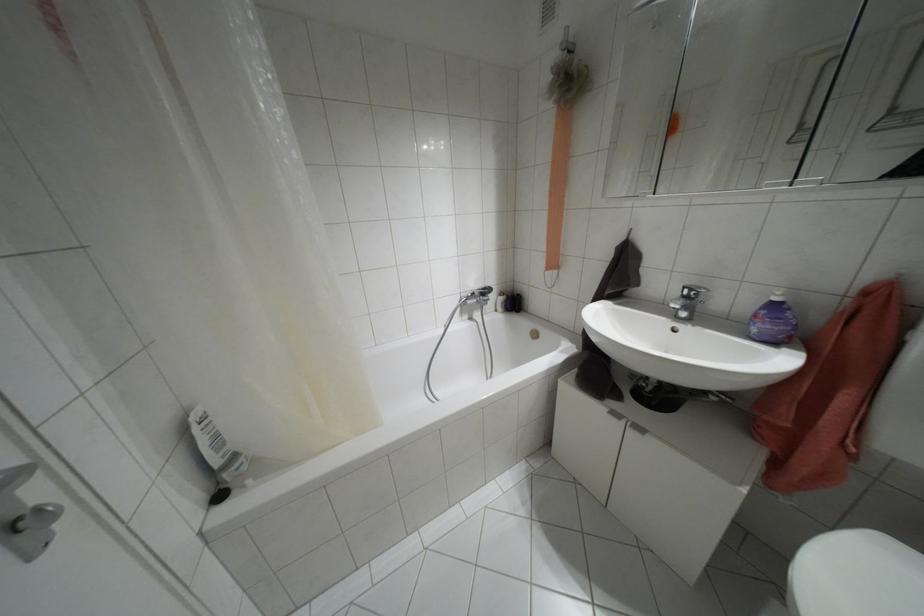
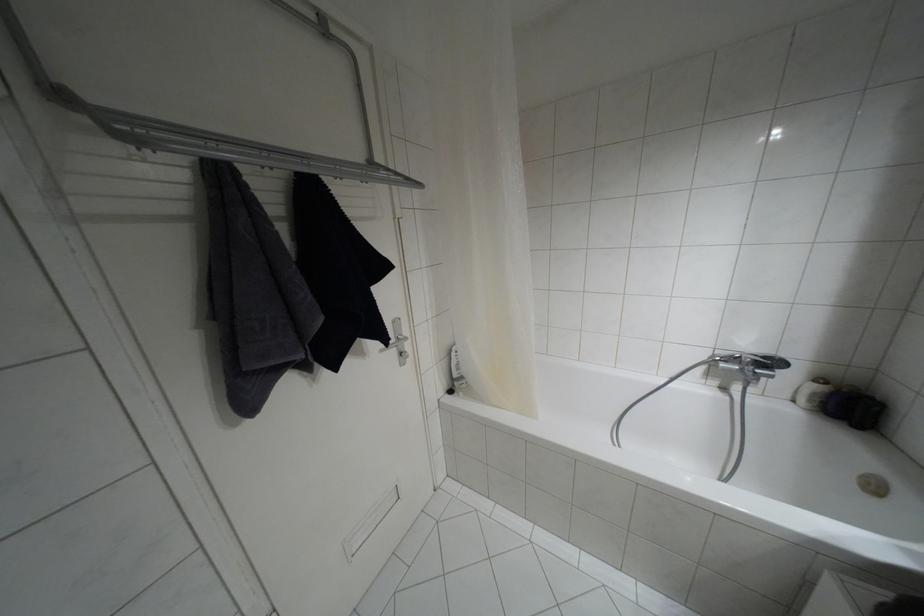
The point at (500, 293) is marked in the first image. Where is the corresponding point in the second image?

(820, 379)